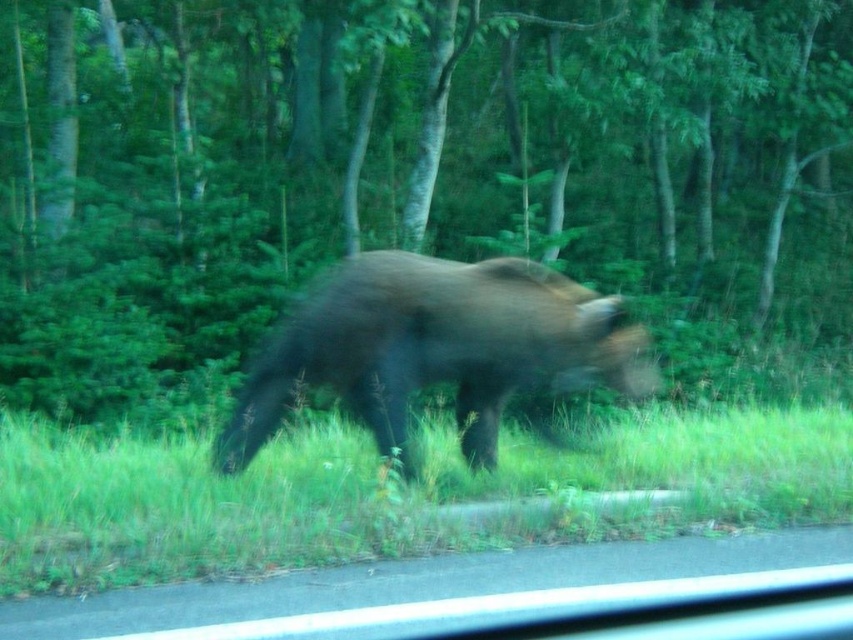
Is point (752, 84) closer to camera compared to point (363, 285)?

That is False.

Between green leafy tree at center and brown furry bear at center, which one has less height?

brown furry bear at center is shorter.

Is point (425, 60) less distant than point (463, 342)?

No, (425, 60) is further to viewer.

Image resolution: width=853 pixels, height=640 pixels. Identify the location of green leafy tree at center. (418, 179).

Who is more distant from viewer, (80,534) or (477,467)?

The point (477,467) is behind.

Is green grass at lower center to the right of brown furry bear at center from the viewer's perspective?

No, green grass at lower center is not to the right of brown furry bear at center.

The image size is (853, 640). I want to click on green grass at lower center, so click(390, 493).

Between green leafy tree at center and green grass at lower center, which one appears on the right side from the viewer's perspective?

green leafy tree at center

Which is in front, point (311, 68) or point (328, 426)?

Point (328, 426) is more forward.

Locate an element on the screen. This screenshot has width=853, height=640. green leafy tree at center is located at coordinates (418, 179).